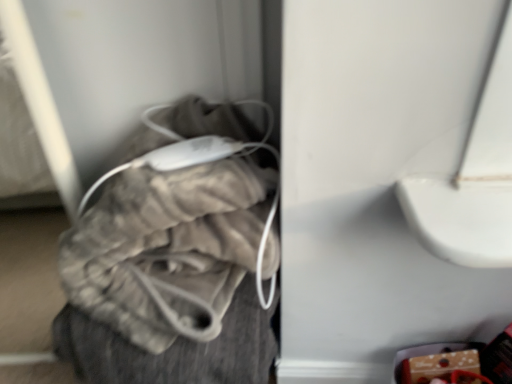
Find the location of a particular element. The height and width of the screenshot is (384, 512). beige cotton towel at center is located at coordinates (168, 249).

Describe the element at coordinates (168, 249) in the screenshot. I see `beige cotton towel at center` at that location.

Where is `beige cotton towel at center`? beige cotton towel at center is located at coordinates (168, 249).